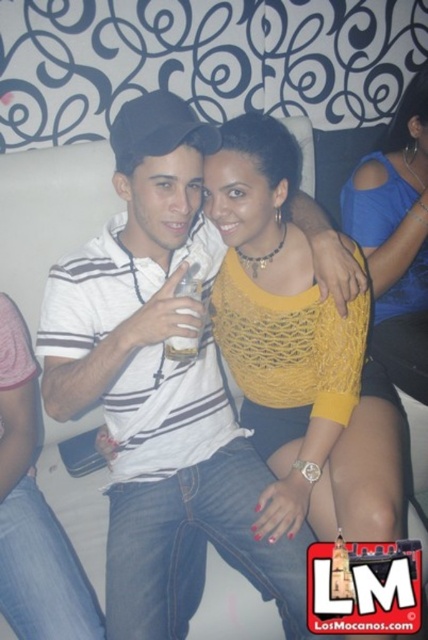
Question: Does white striped shirt at center have a lesser width compared to clear plastic bottle at center?

Choices:
 (A) no
 (B) yes

Answer: (A)

Question: Which object appears closest to the camera in this image?

Choices:
 (A) white striped shirt at center
 (B) blue mesh top at upper right
 (C) clear plastic bottle at center
 (D) yellow knitted top at center

Answer: (A)

Question: Based on their relative distances, which object is nearer to the clear plastic bottle at center?

Choices:
 (A) white striped shirt at center
 (B) yellow knitted top at center
 (C) blue mesh top at upper right

Answer: (A)

Question: Does blue mesh top at upper right appear on the right side of clear plastic bottle at center?

Choices:
 (A) no
 (B) yes

Answer: (B)

Question: Does white striped shirt at center have a greater width compared to yellow knitted top at center?

Choices:
 (A) yes
 (B) no

Answer: (A)

Question: Based on their relative distances, which object is farther from the yellow knitted top at center?

Choices:
 (A) clear plastic bottle at center
 (B) white striped shirt at center

Answer: (A)